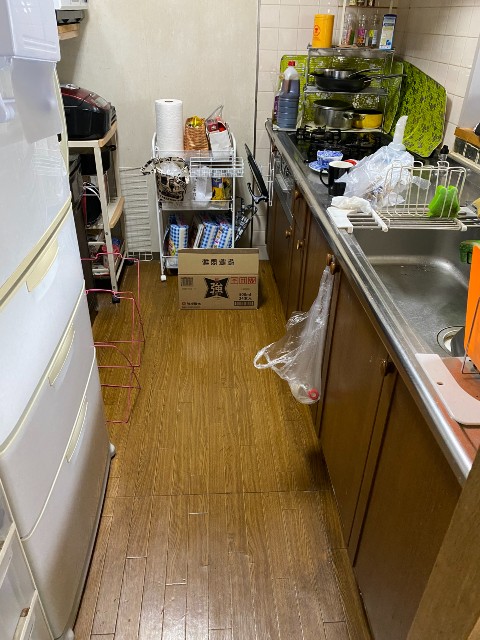
Image resolution: width=480 pixels, height=640 pixels. Identify the location of kitchen device. (91, 112).